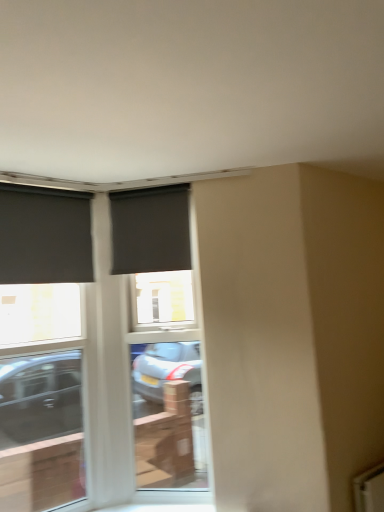
Question: Does matte black roller blind at center, which is the 1th window from right to left, come behind matte black screen door at center?

Choices:
 (A) no
 (B) yes

Answer: (B)

Question: Is matte black roller blind at center, arranged as the 3th window when viewed from the left, looking in the opposite direction of matte black screen door at center?

Choices:
 (A) no
 (B) yes

Answer: (B)

Question: Is matte black roller blind at center, which is the 1th window from right to left, surrounding matte black screen door at center?

Choices:
 (A) no
 (B) yes

Answer: (A)

Question: Is matte black roller blind at center, arranged as the 3th window when viewed from the left, next to matte black screen door at center?

Choices:
 (A) no
 (B) yes

Answer: (A)

Question: From a real-world perspective, does matte black roller blind at center, arranged as the 3th window when viewed from the left, sit lower than matte black screen door at center?

Choices:
 (A) yes
 (B) no

Answer: (B)

Question: From a real-world perspective, is matte black roller blind at left, which is counted as the first window, starting from the left, positioned above or below matte black roller blind at center, which is the 1th window from right to left?

Choices:
 (A) below
 (B) above

Answer: (A)

Question: Is matte black roller blind at left, which ranks as the third window in right-to-left order, wider or thinner than matte black roller blind at center, arranged as the 3th window when viewed from the left?

Choices:
 (A) thin
 (B) wide

Answer: (B)

Question: Visually, is matte black roller blind at left, which ranks as the third window in right-to-left order, positioned to the left or to the right of matte black roller blind at center, arranged as the 3th window when viewed from the left?

Choices:
 (A) left
 (B) right

Answer: (A)

Question: Is point (61, 198) closer or farther from the camera than point (139, 271)?

Choices:
 (A) closer
 (B) farther

Answer: (A)

Question: In terms of width, does matte black roller blind at center, which is the 1th window from right to left, look wider or thinner when compared to matte black screen door at center?

Choices:
 (A) wide
 (B) thin

Answer: (B)

Question: Considering the positions of matte black roller blind at center, which is the 1th window from right to left, and matte black screen door at center in the image, is matte black roller blind at center, which is the 1th window from right to left, taller or shorter than matte black screen door at center?

Choices:
 (A) short
 (B) tall

Answer: (A)

Question: Considering the positions of matte black roller blind at center, which is the 1th window from right to left, and matte black screen door at center in the image, is matte black roller blind at center, which is the 1th window from right to left, bigger or smaller than matte black screen door at center?

Choices:
 (A) small
 (B) big

Answer: (A)

Question: Visually, is matte black roller blind at center, arranged as the 3th window when viewed from the left, positioned to the left or to the right of matte black screen door at center?

Choices:
 (A) right
 (B) left

Answer: (B)

Question: Does point (31, 283) appear closer or farther from the camera than point (170, 462)?

Choices:
 (A) farther
 (B) closer

Answer: (B)

Question: From a real-world perspective, is matte black roller blind at left, which is counted as the first window, starting from the left, above or below matte black screen door at center?

Choices:
 (A) below
 (B) above

Answer: (B)